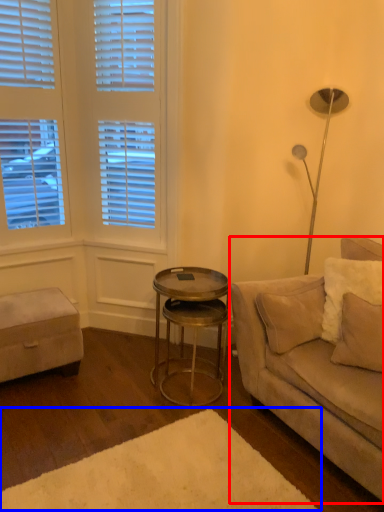
Question: Among these objects, which one is nearest to the camera, studio couch (highlighted by a red box) or plain (highlighted by a blue box)?

Choices:
 (A) studio couch
 (B) plain

Answer: (B)